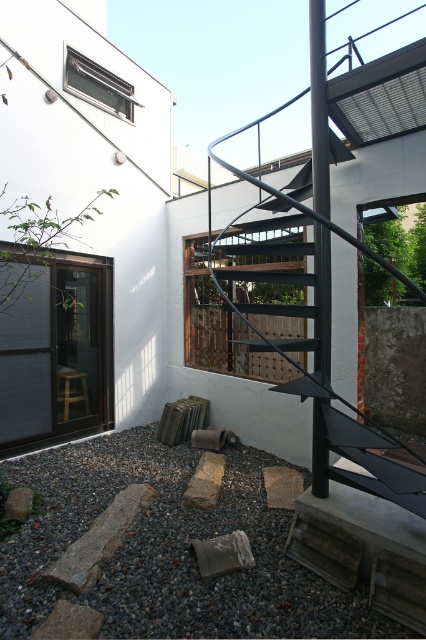
Question: Can you confirm if matte black glass door at left is wider than brown rough stone at center?

Choices:
 (A) yes
 (B) no

Answer: (A)

Question: Observing the image, what is the correct spatial positioning of gray gravel at lower center in reference to black matte staircase at center?

Choices:
 (A) below
 (B) above

Answer: (A)

Question: Which point appears farthest from the camera in this image?

Choices:
 (A) (22, 636)
 (B) (316, 344)
 (C) (282, 472)
 (D) (215, 460)

Answer: (D)

Question: Estimate the real-world distances between objects in this image. Which object is closer to the gray gravel at lower center?

Choices:
 (A) gray rough stone at center
 (B) brown rough stone at center
 (C) black matte staircase at center

Answer: (A)

Question: Which object is the closest to the gray gravel at lower center?

Choices:
 (A) black matte staircase at center
 (B) matte black glass door at left
 (C) gray rough stone at center
 (D) brown rough stone at center

Answer: (C)

Question: Can you confirm if matte black glass door at left is positioned above gray rough stone at center?

Choices:
 (A) yes
 (B) no

Answer: (A)